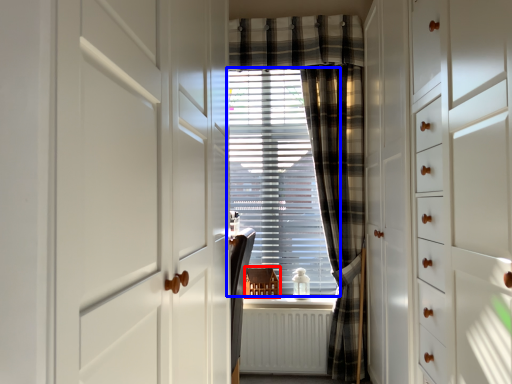
Question: Which object appears farthest to the camera in this image, furniture (highlighted by a red box) or window blind (highlighted by a blue box)?

Choices:
 (A) furniture
 (B) window blind

Answer: (B)